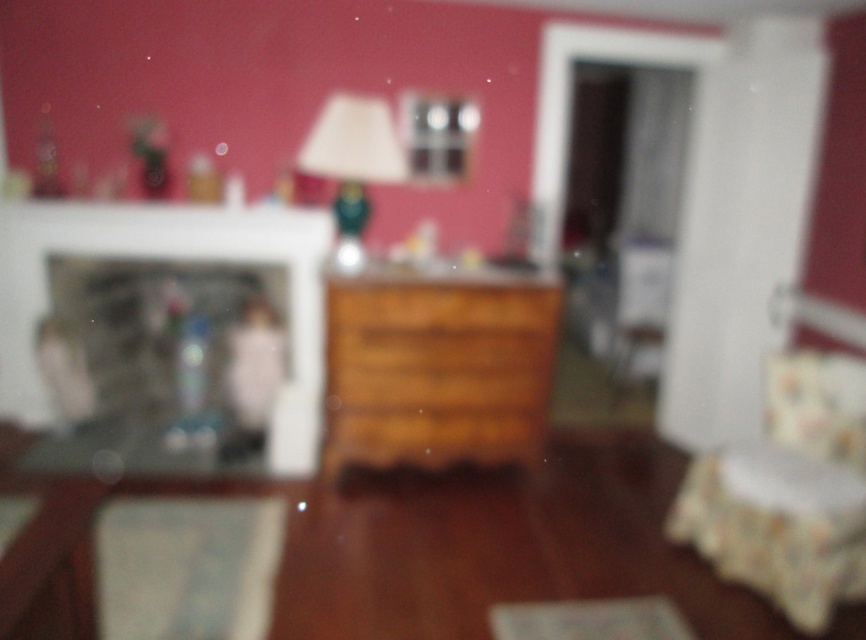
Question: Among these points, which one is nearest to the camera?

Choices:
 (A) (724, 481)
 (B) (362, 182)

Answer: (A)

Question: Is white glossy fireplace at center above wooden drawer at center?

Choices:
 (A) yes
 (B) no

Answer: (B)

Question: Can you confirm if floral fabric armchair at lower right is positioned to the right of white glossy fireplace at center?

Choices:
 (A) no
 (B) yes

Answer: (B)

Question: Which of the following is the farthest from the observer?

Choices:
 (A) white glossy fireplace at center
 (B) wooden drawer at center
 (C) floral fabric armchair at lower right

Answer: (A)

Question: Which object is closer to the camera taking this photo?

Choices:
 (A) floral fabric armchair at lower right
 (B) wooden drawer at center

Answer: (A)

Question: Does white glossy fireplace at center come behind matte green lamp at center?

Choices:
 (A) no
 (B) yes

Answer: (B)